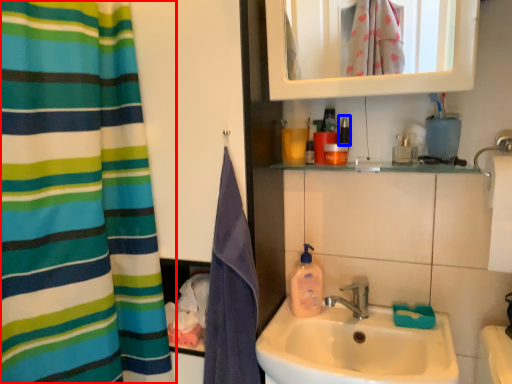
Question: Which object is further to the camera taking this photo, curtain (highlighted by a red box) or mouthwash (highlighted by a blue box)?

Choices:
 (A) curtain
 (B) mouthwash

Answer: (B)